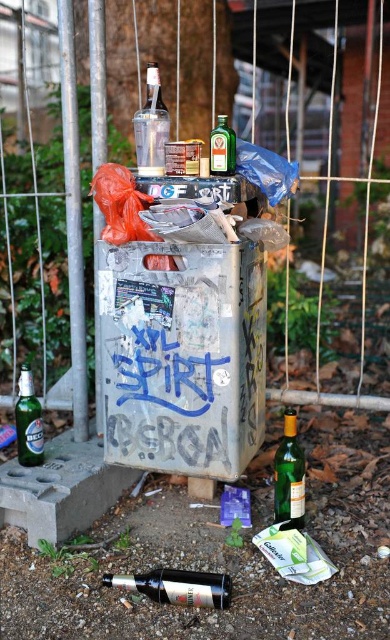
Question: Can you confirm if clear glass bottle at upper center is positioned to the right of green glass bottle at upper center?

Choices:
 (A) no
 (B) yes

Answer: (A)

Question: Which point appears farthest from the camera in this image?

Choices:
 (A) (278, 474)
 (B) (191, 454)

Answer: (A)

Question: Estimate the real-world distances between objects in this image. Which object is farther from the silver metallic trash can at center?

Choices:
 (A) green glass bottle at upper center
 (B) clear glass bottle at upper center
 (C) green glass bottle at lower left

Answer: (C)

Question: Does green glass bottle at center have a larger size compared to green glass bottle at lower left?

Choices:
 (A) no
 (B) yes

Answer: (B)

Question: Which point is farther from the camera taking this photo?

Choices:
 (A) (175, 449)
 (B) (166, 600)

Answer: (A)

Question: Can you confirm if green glass bottle at lower left is bigger than green glass bottle at upper center?

Choices:
 (A) yes
 (B) no

Answer: (A)